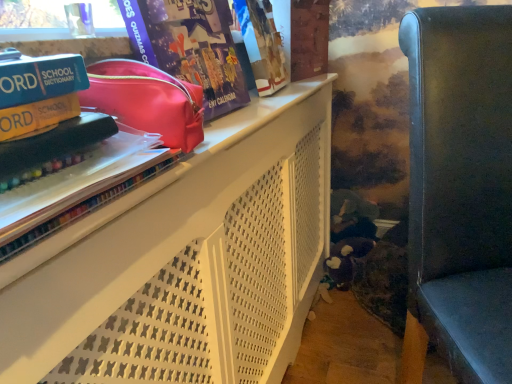
Question: Does white matte shelf at upper left come in front of shiny pink pouch at upper center?

Choices:
 (A) no
 (B) yes

Answer: (B)

Question: Does white matte shelf at upper left have a larger size compared to shiny pink pouch at upper center?

Choices:
 (A) no
 (B) yes

Answer: (B)

Question: From the image's perspective, would you say white matte shelf at upper left is positioned over shiny pink pouch at upper center?

Choices:
 (A) no
 (B) yes

Answer: (A)

Question: Could you tell me if white matte shelf at upper left is turned towards shiny pink pouch at upper center?

Choices:
 (A) no
 (B) yes

Answer: (A)

Question: Is white matte shelf at upper left further to the viewer compared to shiny pink pouch at upper center?

Choices:
 (A) no
 (B) yes

Answer: (A)

Question: Is translucent plastic book at upper left inside or outside of white matte shelf at upper left?

Choices:
 (A) inside
 (B) outside

Answer: (B)

Question: Is translucent plastic book at upper left to the left or to the right of white matte shelf at upper left in the image?

Choices:
 (A) left
 (B) right

Answer: (A)

Question: Does point (174, 144) appear closer or farther from the camera than point (308, 210)?

Choices:
 (A) closer
 (B) farther

Answer: (A)

Question: From their relative heights in the image, would you say translucent plastic book at upper left is taller or shorter than white matte shelf at upper left?

Choices:
 (A) tall
 (B) short

Answer: (B)

Question: From their relative heights in the image, would you say translucent plastic book at upper left is taller or shorter than yellow matte paperback book at upper left, which is the 1th paperback book from bottom to top?

Choices:
 (A) tall
 (B) short

Answer: (A)

Question: Looking at their shapes, would you say translucent plastic book at upper left is wider or thinner than yellow matte paperback book at upper left, which ranks as the 2th paperback book in top-to-bottom order?

Choices:
 (A) thin
 (B) wide

Answer: (B)

Question: Is translucent plastic book at upper left to the left or to the right of yellow matte paperback book at upper left, which ranks as the 2th paperback book in top-to-bottom order, in the image?

Choices:
 (A) right
 (B) left

Answer: (A)

Question: Is point (152, 124) positioned closer to the camera than point (7, 137)?

Choices:
 (A) farther
 (B) closer

Answer: (A)

Question: Considering the relative positions of metallic gray chair at right and shiny pink pouch at upper center in the image provided, is metallic gray chair at right to the left or to the right of shiny pink pouch at upper center?

Choices:
 (A) right
 (B) left

Answer: (A)

Question: Is metallic gray chair at right inside the boundaries of shiny pink pouch at upper center, or outside?

Choices:
 (A) outside
 (B) inside

Answer: (A)